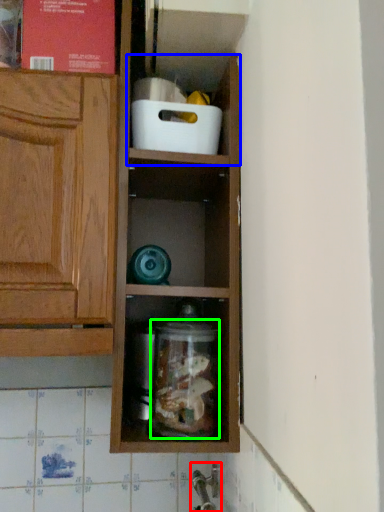
Question: Estimate the real-world distances between objects in this image. Which object is closer to faucet (highlighted by a red box), cabinet (highlighted by a blue box) or glass jar (highlighted by a green box)?

Choices:
 (A) cabinet
 (B) glass jar

Answer: (B)